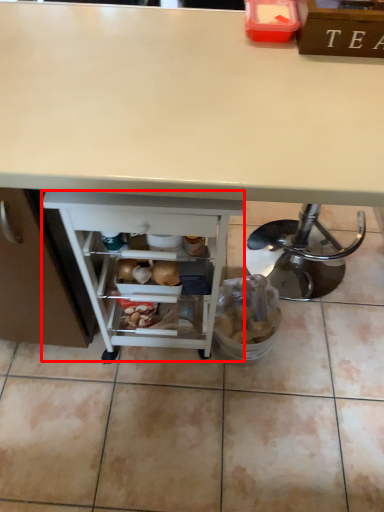
Question: From the image's perspective, what is the correct spatial relationship of shelf (annotated by the red box) in relation to desk?

Choices:
 (A) above
 (B) below

Answer: (B)